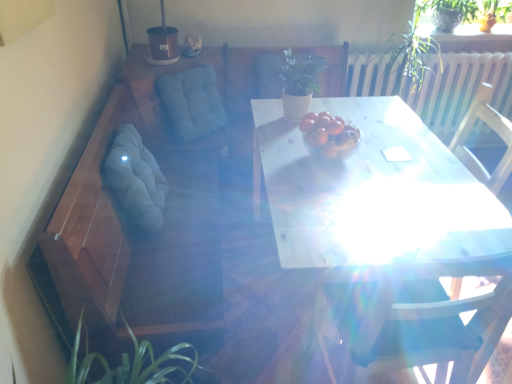
Question: Is translucent glass bowl at center thinner than green matte plant at center, the second plant viewed from the top?

Choices:
 (A) no
 (B) yes

Answer: (A)

Question: Is the depth of translucent glass bowl at center greater than that of green matte plant at center, the 2th plant viewed from the right?

Choices:
 (A) yes
 (B) no

Answer: (B)

Question: Can you confirm if translucent glass bowl at center is positioned to the right of green matte plant at center, placed as the first plant when sorted from left to right?

Choices:
 (A) yes
 (B) no

Answer: (A)

Question: From the image's perspective, would you say translucent glass bowl at center is shown under green matte plant at center, the second plant viewed from the top?

Choices:
 (A) yes
 (B) no

Answer: (A)

Question: Is translucent glass bowl at center closer to camera compared to green matte plant at center, the second plant viewed from the top?

Choices:
 (A) no
 (B) yes

Answer: (B)

Question: From the image's perspective, would you say translucent glass bowl at center is positioned over green matte plant at center, placed as the first plant when sorted from left to right?

Choices:
 (A) no
 (B) yes

Answer: (A)

Question: From a real-world perspective, is blue fabric cushion at upper left, which appears as the second swivel chair when viewed from the front, below white glossy table at center?

Choices:
 (A) no
 (B) yes

Answer: (A)

Question: Could you tell me if blue fabric cushion at upper left, which appears as the second swivel chair when viewed from the front, is turned towards white glossy table at center?

Choices:
 (A) no
 (B) yes

Answer: (B)

Question: Is white glossy table at center located within blue fabric cushion at upper left, which appears as the second swivel chair when viewed from the front?

Choices:
 (A) yes
 (B) no

Answer: (B)

Question: Are blue fabric cushion at upper left, which appears as the second swivel chair when viewed from the front, and white glossy table at center located far from each other?

Choices:
 (A) yes
 (B) no

Answer: (B)

Question: Does blue fabric cushion at upper left, which appears as the 1th swivel chair when viewed from the back, have a greater height compared to white glossy table at center?

Choices:
 (A) yes
 (B) no

Answer: (B)

Question: Does blue fabric cushion at upper left, which appears as the second swivel chair when viewed from the front, appear on the left side of white glossy table at center?

Choices:
 (A) yes
 (B) no

Answer: (A)

Question: From a real-world perspective, is soft gray fabric swivel chair at left, the second swivel chair from the back, physically below blue fabric cushion at upper left, which appears as the 1th swivel chair when viewed from the back?

Choices:
 (A) no
 (B) yes

Answer: (B)